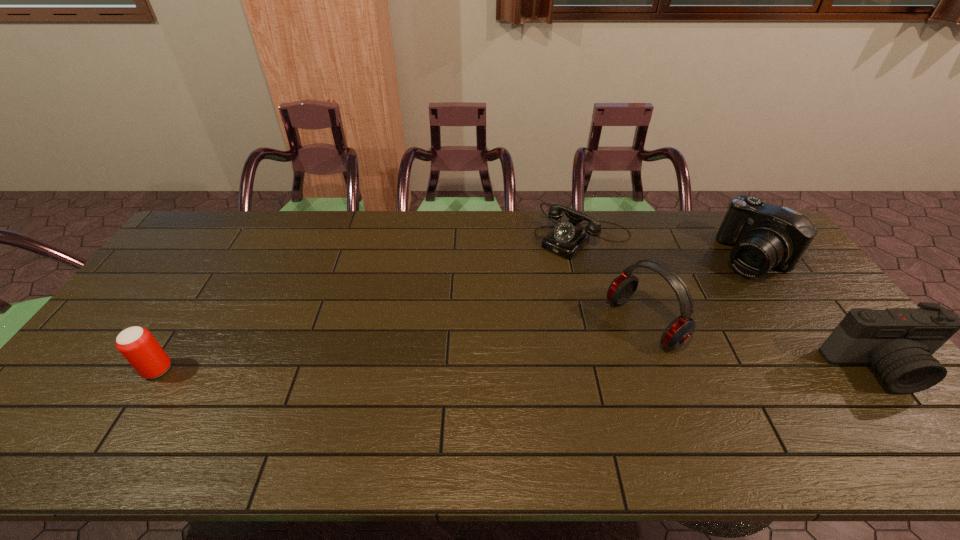
At what (x,y) coordinates should I click in order to perform the action: click on object positioned at the far right corner. Please return your answer as a coordinate pair (x, y). The image size is (960, 540). Looking at the image, I should click on (765, 236).

Where is `object that is at the near right corner`? This screenshot has width=960, height=540. object that is at the near right corner is located at coordinates (898, 343).

You are a GUI agent. You are given a task and a screenshot of the screen. Output one action in this format:
    pyautogui.click(x=<x>, y=<y>)
    Task: Click on the free region at the far edge of the desktop
    Image resolution: width=960 pixels, height=540 pixels.
    Given the screenshot: What is the action you would take?
    pyautogui.click(x=326, y=215)

What are the coordinates of `blank space at the near edge of the desktop` in the screenshot? It's located at (235, 392).

Find the location of `vacant space at the left edge of the desktop`. vacant space at the left edge of the desktop is located at coordinates (153, 335).

In the image, there is a desktop. In order to click on vacant space at the near right corner in this screenshot , I will do click(x=849, y=408).

I want to click on unoccupied area between the earphone and the beer can, so click(401, 346).

This screenshot has height=540, width=960. I want to click on free space that is in between the shortest object and the second shortest object, so click(x=371, y=303).

Locate an element on the screen. Image resolution: width=960 pixels, height=540 pixels. free space that is in between the earphone and the nearer camera is located at coordinates (761, 346).

Identify the location of unoccupied position between the nearer camera and the earphone. (761, 346).